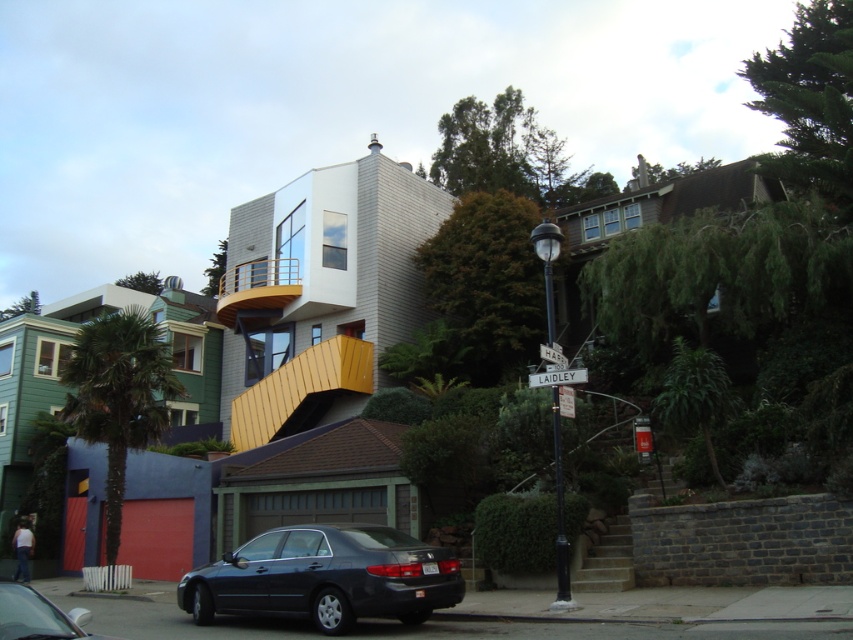
You are a delivery driver approaching the house and need to read both the black metal street sign at center and the white plastic street sign at center. Which one is positioned higher up?

The black metal street sign at center is located above the white plastic street sign at center, so it is positioned higher up.

You are a delivery person needing to park your 5.5 meter long truck between the shiny black sedan at lower left and the stone retaining wall at the base of the slope. Can you fit your truck there?

The distance between the shiny black sedan at lower left and the stone retaining wall at the base of the slope is 6.76 meters. Since your truck is 5.5 meters long, there is enough space to park it between them.

From the picture: You are a delivery driver who needs to read both the black metal street sign at center and the white plastic street sign at center. Which one is easier to see from a distance?

The black metal street sign at center has a larger size compared to the white plastic street sign at center, so it is easier to see from a distance.